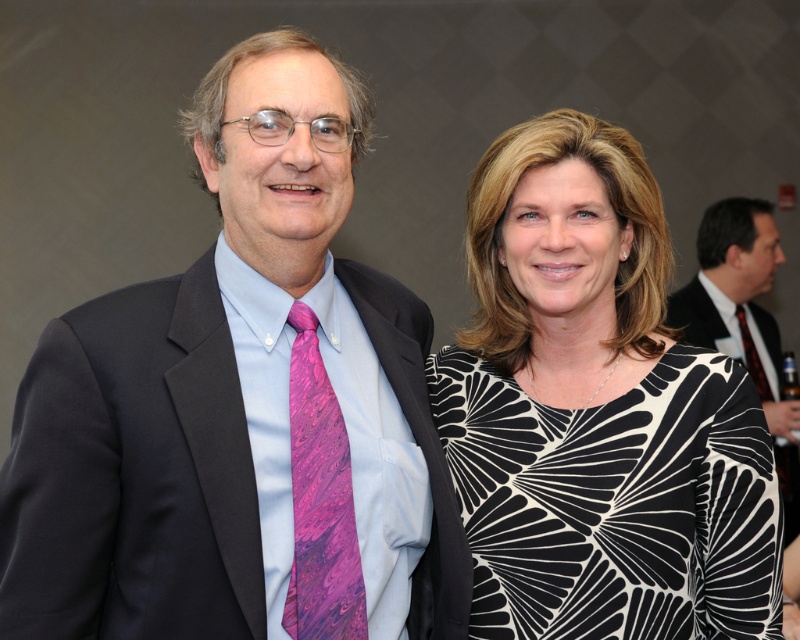
You are a photographer adjusting the focus on your camera. The camera is set to focus on the matte black suit at center. Given that the depth of field can only clearly capture objects within 3 meters, will the pink silk tie at right also be in focus?

The matte black suit at center is 3.18 meters away from the pink silk tie at right. Since the depth of field can only clearly capture objects within 3 meters, the pink silk tie at right will be slightly out of focus.

You are a photographer who wants to ensure that both the black printed dress at right and the pink silk tie at right are visible in the photo. Based on their positions, which one is closer to the bottom of the frame?

The black printed dress at right is below the pink silk tie at right, so it is closer to the bottom of the frame.